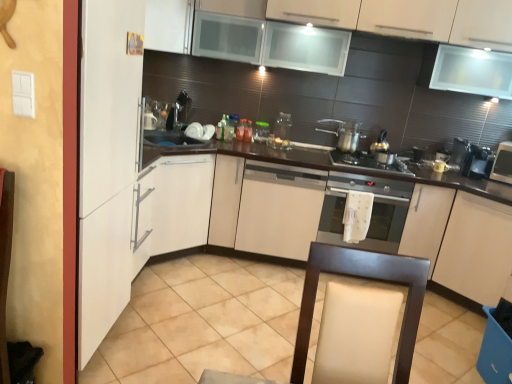
Measure the distance between metallic silver gas stove at center and camera.

The distance of metallic silver gas stove at center from camera is 3.01 meters.

What is the approximate width of metallic silver gas stove at center?

It is 20.09 inches.

You are a GUI agent. You are given a task and a screenshot of the screen. Output one action in this format:
    pyautogui.click(x=<x>, y=<y>)
    Task: Click on the white matte cabinet at upper left, which is the first cabinetry in top-to-bottom order
    This screenshot has height=384, width=512.
    Given the screenshot: What is the action you would take?
    169,25

Where is `metallic silver gas stove at center`? The width and height of the screenshot is (512, 384). metallic silver gas stove at center is located at coordinates (368, 162).

Considering the positions of objects white matte cabinet at center, the 3th cabinetry viewed from the top, and white matte cabinet at upper center, placed as the 3th cabinetry when sorted from bottom to top, in the image provided, who is behind, white matte cabinet at center, the 3th cabinetry viewed from the top, or white matte cabinet at upper center, placed as the 3th cabinetry when sorted from bottom to top,?

white matte cabinet at center, the 3th cabinetry viewed from the top.

How much distance is there between white matte cabinet at center, the 3th cabinetry viewed from the top, and white matte cabinet at upper center, the second cabinetry from the top?

white matte cabinet at center, the 3th cabinetry viewed from the top, is 1.26 meters from white matte cabinet at upper center, the second cabinetry from the top.

From their relative heights in the image, would you say white matte cabinet at center, the 3th cabinetry viewed from the top, is taller or shorter than white matte cabinet at upper center, the second cabinetry from the top?

In the image, white matte cabinet at center, the 3th cabinetry viewed from the top, appears to be taller than white matte cabinet at upper center, the second cabinetry from the top.

From the image's perspective, is white matte cabinet at center, the 3th cabinetry viewed from the top, located above white matte cabinet at upper center, placed as the 3th cabinetry when sorted from bottom to top?

No, from the image's perspective, white matte cabinet at center, the 3th cabinetry viewed from the top, is not on top of white matte cabinet at upper center, placed as the 3th cabinetry when sorted from bottom to top.

Is leather-like beige swivel chair at lower center with matte white cabinet at right, positioned as the fourth cabinetry in top-to-bottom order?

leather-like beige swivel chair at lower center is not next to matte white cabinet at right, positioned as the fourth cabinetry in top-to-bottom order, and they're not touching.

From a real-world perspective, is leather-like beige swivel chair at lower center beneath matte white cabinet at right, marked as the first cabinetry in a bottom-to-top arrangement?

Actually, leather-like beige swivel chair at lower center is physically above matte white cabinet at right, marked as the first cabinetry in a bottom-to-top arrangement, in the real world.

Does leather-like beige swivel chair at lower center have a greater width compared to matte white cabinet at right, positioned as the fourth cabinetry in top-to-bottom order?

No, leather-like beige swivel chair at lower center is not wider than matte white cabinet at right, positioned as the fourth cabinetry in top-to-bottom order.

From a real-world perspective, who is located higher, metallic silver gas stove at center or metallic silver toaster at right, the first appliance viewed from the right?

metallic silver toaster at right, the first appliance viewed from the right, is physically above.

Which point is more distant from viewer, [369,162] or [508,146]?

The point [508,146] is farther from the camera.

Does dark wood countertop at center have a lesser height compared to metallic silver toaster at right, which is the second appliance from right to left?

Incorrect, the height of dark wood countertop at center does not fall short of that of metallic silver toaster at right, which is the second appliance from right to left.

Considering the relative positions of dark wood countertop at center and metallic silver toaster at right, placed as the fourth appliance when sorted from left to right, in the image provided, is dark wood countertop at center to the right of metallic silver toaster at right, placed as the fourth appliance when sorted from left to right, from the viewer's perspective?

No, dark wood countertop at center is not to the right of metallic silver toaster at right, placed as the fourth appliance when sorted from left to right.

Is dark wood countertop at center far from metallic silver toaster at right, which is the second appliance from right to left?

dark wood countertop at center is actually quite close to metallic silver toaster at right, which is the second appliance from right to left.

Could you tell me if dark wood countertop at center is turned towards metallic silver toaster at right, placed as the fourth appliance when sorted from left to right?

No, dark wood countertop at center is not turned towards metallic silver toaster at right, placed as the fourth appliance when sorted from left to right.

Locate an element on the screen. swivel chair on the left of the dark wood countertop at center is located at coordinates pos(364,277).

From a real-world perspective, which object rests below the other?

In real-world perspective, dark wood countertop at center is lower.

Is dark wood countertop at center looking in the opposite direction of leather-like beige swivel chair at lower center?

No, dark wood countertop at center is not facing the opposite direction of leather-like beige swivel chair at lower center.

Can you confirm if dark wood countertop at center is bigger than leather-like beige swivel chair at lower center?

Yes, dark wood countertop at center is bigger than leather-like beige swivel chair at lower center.

Which appliance is the 3rd one when counting from the right side of the transparent plastic container at center, which ranks as the second appliance in left-to-right order? Please provide its 2D coordinates.

[(502, 164)]

Does transparent plastic container at center, which ranks as the second appliance in left-to-right order, have a lesser height compared to metallic silver toaster at right, the fifth appliance viewed from the left?

Indeed, transparent plastic container at center, which ranks as the second appliance in left-to-right order, has a lesser height compared to metallic silver toaster at right, the fifth appliance viewed from the left.

From the image's perspective, between transparent plastic container at center, which ranks as the second appliance in left-to-right order, and metallic silver toaster at right, the fifth appliance viewed from the left, who is located below?

metallic silver toaster at right, the fifth appliance viewed from the left, is shown below in the image.

This screenshot has height=384, width=512. Find the location of `swivel chair in front of the metallic silver toaster at right, the fifth appliance viewed from the left`. swivel chair in front of the metallic silver toaster at right, the fifth appliance viewed from the left is located at coordinates (364, 277).

Considering the sizes of objects metallic silver toaster at right, the fifth appliance viewed from the left, and leather-like beige swivel chair at lower center in the image provided, who is thinner, metallic silver toaster at right, the fifth appliance viewed from the left, or leather-like beige swivel chair at lower center?

With smaller width is metallic silver toaster at right, the fifth appliance viewed from the left.

Does metallic silver toaster at right, the first appliance viewed from the right, have a lesser height compared to leather-like beige swivel chair at lower center?

Correct, metallic silver toaster at right, the first appliance viewed from the right, is not as tall as leather-like beige swivel chair at lower center.

Is metallic silver toaster at right, the fifth appliance viewed from the left, next to leather-like beige swivel chair at lower center and touching it?

No.

What are the coordinates of `the 1st cabinetry above the white matte cabinet at center, the 3th cabinetry viewed from the top (from the image's perspective)` in the screenshot? It's located at (393, 18).

Where is `swivel chair that appears above the matte white cabinet at right, marked as the first cabinetry in a bottom-to-top arrangement (from a real-world perspective)`? Image resolution: width=512 pixels, height=384 pixels. swivel chair that appears above the matte white cabinet at right, marked as the first cabinetry in a bottom-to-top arrangement (from a real-world perspective) is located at coordinates (364, 277).

Looking at the image, which one is located further to white glossy bowl at upper center, which is the fifth appliance in right-to-left order, metallic silver toaster at right, the first appliance viewed from the right, or satin silver oven at center?

metallic silver toaster at right, the first appliance viewed from the right, lies further to white glossy bowl at upper center, which is the fifth appliance in right-to-left order, than the other object.

Estimate the real-world distances between objects in this image. Which object is further from metallic silver toaster at right, the fifth appliance viewed from the left, metallic silver gas stove at center or satin silver oven at center?

satin silver oven at center is positioned further to the anchor metallic silver toaster at right, the fifth appliance viewed from the left.

Considering their positions, is metallic silver coffee machine at right, placed as the 2th coffee machine when sorted from right to left, positioned further to metallic silver toaster at right, the fifth appliance viewed from the left, than dark wood countertop at center?

dark wood countertop at center.

When comparing their distances from metallic silver toaster at right, the first appliance viewed from the right, does transparent plastic container at center, which ranks as the second appliance in left-to-right order, or metallic silver pot at center right seem closer?

Among the two, metallic silver pot at center right is located nearer to metallic silver toaster at right, the first appliance viewed from the right.

Which object lies nearer to the anchor point dark wood countertop at center, white matte cabinet at upper left, which is the first cabinetry in top-to-bottom order, or metallic silver pot at center right?

metallic silver pot at center right lies closer to dark wood countertop at center than the other object.

From the image, which object appears to be farther from white glossy bowl at upper center, arranged as the 1th appliance when viewed from the left, white matte cabinet at center, which appears as the 2th cabinetry when ordered from the bottom, or dark wood countertop at center?

dark wood countertop at center is further to white glossy bowl at upper center, arranged as the 1th appliance when viewed from the left.

Considering their positions, is black plastic coffee machine at right, the 2th coffee machine positioned from the left, positioned closer to transparent plastic container at center, which is the fourth appliance from right to left, than metallic silver toaster at right, the fifth appliance viewed from the left?

black plastic coffee machine at right, the 2th coffee machine positioned from the left.

Based on their spatial positions, is black plastic coffee machine at right, the 1th coffee machine positioned from the right, or white matte cabinet at center, the 3th cabinetry viewed from the top, further from metallic silver coffee machine at right, placed as the 2th coffee machine when sorted from right to left?

Based on the image, white matte cabinet at center, the 3th cabinetry viewed from the top, appears to be further to metallic silver coffee machine at right, placed as the 2th coffee machine when sorted from right to left.

You are a GUI agent. You are given a task and a screenshot of the screen. Output one action in this format:
    pyautogui.click(x=<x>, y=<y>)
    Task: Click on the home appliance between white glossy bowl at upper center, arranged as the 1th appliance when viewed from the left, and metallic silver gas stove at center
    The height and width of the screenshot is (384, 512).
    Given the screenshot: What is the action you would take?
    pyautogui.click(x=371, y=213)

Where is `home appliance positioned between leather-like beige swivel chair at lower center and metallic silver toaster at right, placed as the fourth appliance when sorted from left to right, from near to far`? This screenshot has height=384, width=512. home appliance positioned between leather-like beige swivel chair at lower center and metallic silver toaster at right, placed as the fourth appliance when sorted from left to right, from near to far is located at coordinates pos(371,213).

Identify the location of gas stove between dark wood countertop at center and black plastic coffee machine at right, the 2th coffee machine positioned from the left, from left to right. The image size is (512, 384). (368, 162).

Find the location of a particular element. This screenshot has height=384, width=512. cabinetry situated between white glossy bowl at upper center, arranged as the 1th appliance when viewed from the left, and dark wood countertop at center from left to right is located at coordinates (279, 209).